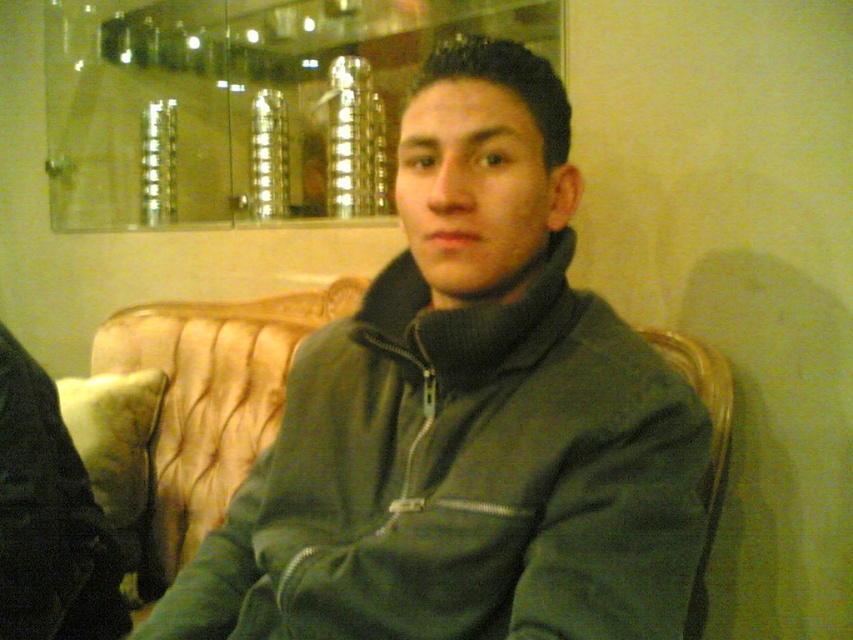
Question: Considering the relative positions of green matte jacket at center and green fabric chair at right in the image provided, where is green matte jacket at center located with respect to green fabric chair at right?

Choices:
 (A) left
 (B) right

Answer: (A)

Question: Considering the real-world distances, which object is farthest from the green fabric chair at right?

Choices:
 (A) black fabric at left
 (B) green matte jacket at center

Answer: (A)

Question: Does green matte jacket at center have a smaller size compared to green fabric chair at right?

Choices:
 (A) no
 (B) yes

Answer: (A)

Question: Which point is closer to the camera?

Choices:
 (A) (13, 508)
 (B) (722, 372)
 (C) (581, 292)

Answer: (C)

Question: Can you confirm if green matte jacket at center is positioned above black fabric at left?

Choices:
 (A) no
 (B) yes

Answer: (B)

Question: Which object appears farthest from the camera in this image?

Choices:
 (A) black fabric at left
 (B) green fabric chair at right

Answer: (A)